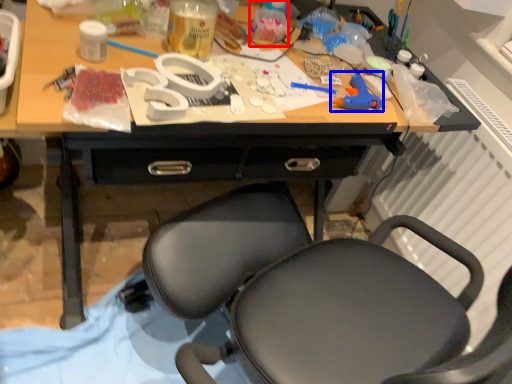
Question: Which of the following is the farthest to the observer, bottle (highlighted by a red box) or toy (highlighted by a blue box)?

Choices:
 (A) bottle
 (B) toy

Answer: (A)